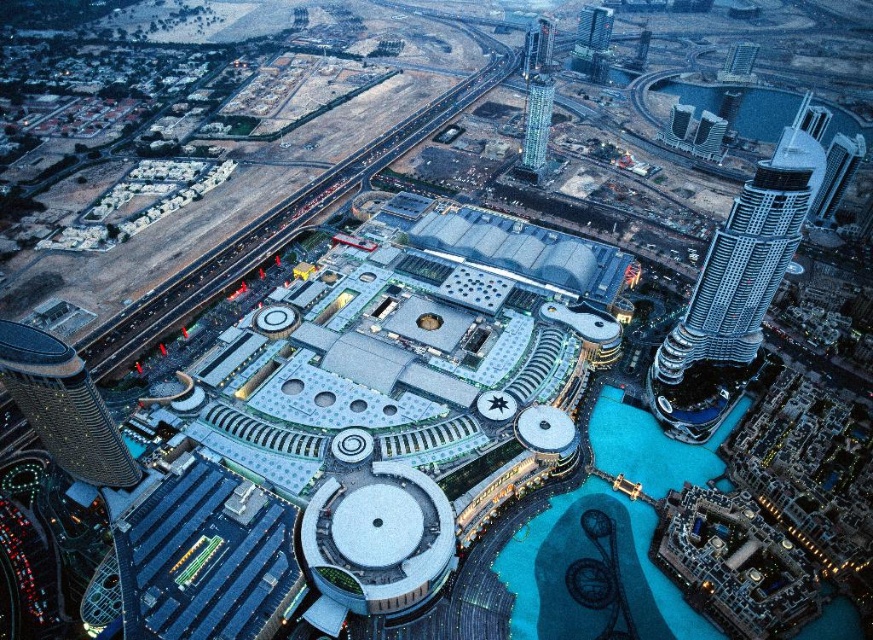
Can you confirm if silver metallic skyscraper at right is thinner than glassy skyscraper at upper center?

No.

Where is `silver metallic skyscraper at right`? This screenshot has width=873, height=640. silver metallic skyscraper at right is located at coordinates (741, 273).